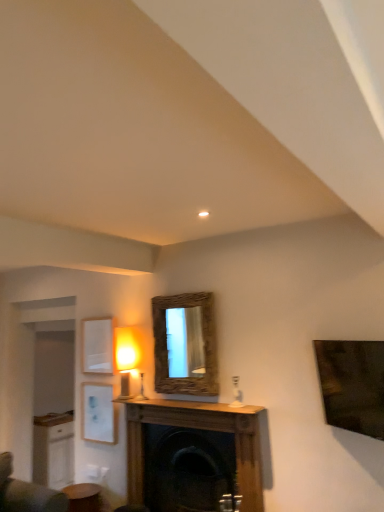
Question: Is white matte picture frame at upper left, which appears as the second picture frame when ordered from the bottom, to the right of wooden fireplace at center from the viewer's perspective?

Choices:
 (A) no
 (B) yes

Answer: (A)

Question: From the image's perspective, does white matte picture frame at upper left, which appears as the second picture frame when ordered from the bottom, appear lower than wooden fireplace at center?

Choices:
 (A) no
 (B) yes

Answer: (A)

Question: Is wooden fireplace at center at the back of white matte picture frame at upper left, which appears as the second picture frame when ordered from the bottom?

Choices:
 (A) no
 (B) yes

Answer: (A)

Question: Considering the relative sizes of white matte picture frame at upper left, which appears as the second picture frame when ordered from the bottom, and wooden fireplace at center in the image provided, is white matte picture frame at upper left, which appears as the second picture frame when ordered from the bottom, taller than wooden fireplace at center?

Choices:
 (A) yes
 (B) no

Answer: (B)

Question: Is white matte picture frame at upper left, which appears as the second picture frame when ordered from the bottom, at the left side of wooden fireplace at center?

Choices:
 (A) no
 (B) yes

Answer: (B)

Question: In terms of width, does white matte picture frame at lower left, the 2th picture frame in the top-to-bottom sequence, look wider or thinner when compared to wooden fireplace at center?

Choices:
 (A) thin
 (B) wide

Answer: (A)

Question: In terms of height, does white matte picture frame at lower left, the 2th picture frame in the top-to-bottom sequence, look taller or shorter compared to wooden fireplace at center?

Choices:
 (A) tall
 (B) short

Answer: (B)

Question: Is point (92, 389) positioned closer to the camera than point (213, 432)?

Choices:
 (A) closer
 (B) farther

Answer: (B)

Question: Is white matte picture frame at lower left, the first picture frame in the bottom-to-top sequence, to the left or to the right of wooden fireplace at center in the image?

Choices:
 (A) left
 (B) right

Answer: (A)

Question: From a real-world perspective, is white matte picture frame at upper left, the first picture frame from the top, physically located above or below white wood cabinet at lower left?

Choices:
 (A) below
 (B) above

Answer: (B)

Question: From the image's perspective, is white matte picture frame at upper left, which appears as the second picture frame when ordered from the bottom, located above or below white wood cabinet at lower left?

Choices:
 (A) above
 (B) below

Answer: (A)

Question: Which is correct: white matte picture frame at upper left, which appears as the second picture frame when ordered from the bottom, is inside white wood cabinet at lower left, or outside of it?

Choices:
 (A) inside
 (B) outside

Answer: (B)

Question: Relative to white wood cabinet at lower left, is white matte picture frame at upper left, the first picture frame from the top, in front or behind?

Choices:
 (A) front
 (B) behind

Answer: (A)

Question: In the image, is white matte picture frame at lower left, the 2th picture frame in the top-to-bottom sequence, positioned in front of or behind wooden table at lower left?

Choices:
 (A) behind
 (B) front

Answer: (A)

Question: From their relative heights in the image, would you say white matte picture frame at lower left, the 2th picture frame in the top-to-bottom sequence, is taller or shorter than wooden table at lower left?

Choices:
 (A) short
 (B) tall

Answer: (B)